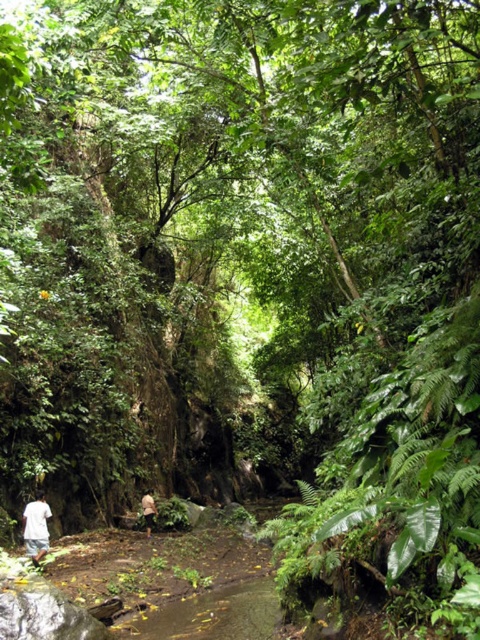
Question: Which of the following is the farthest from the observer?

Choices:
 (A) brown fabric person at center
 (B) white cotton shirt at lower left

Answer: (A)

Question: Observing the image, what is the correct spatial positioning of white cotton shirt at lower left in reference to brown fabric person at center?

Choices:
 (A) right
 (B) left

Answer: (B)

Question: Is white cotton shirt at lower left closer to the viewer compared to brown fabric person at center?

Choices:
 (A) yes
 (B) no

Answer: (A)

Question: Can you confirm if white cotton shirt at lower left is positioned below brown fabric person at center?

Choices:
 (A) no
 (B) yes

Answer: (A)

Question: Which of the following is the farthest from the observer?

Choices:
 (A) white cotton shirt at lower left
 (B) brown fabric person at center

Answer: (B)